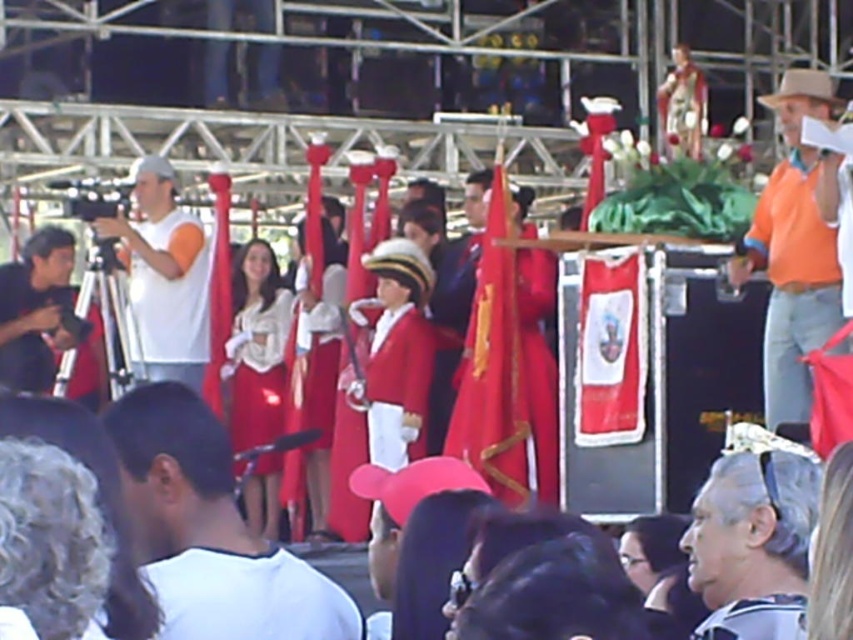
Does smooth black hair at center have a lesser width compared to matte red robe at center?

No.

Is smooth black hair at center positioned in front of matte red robe at center?

Yes.

Between point (848, 560) and point (335, 481), which one is positioned in front?

Point (848, 560) is in front.

Where is `smooth black hair at center`? smooth black hair at center is located at coordinates (833, 552).

Can you confirm if orange cotton shirt at right is wider than matte red robe at center?

Yes, orange cotton shirt at right is wider than matte red robe at center.

The height and width of the screenshot is (640, 853). I want to click on orange cotton shirt at right, so click(x=792, y=252).

Who is more forward, (770, 240) or (332, 593)?

Point (332, 593) is more forward.

Does orange cotton shirt at right lie behind white matte shirt at lower left?

Yes, it is behind white matte shirt at lower left.

I want to click on orange cotton shirt at right, so click(792, 252).